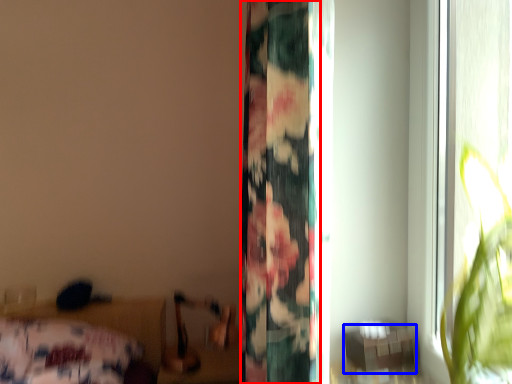
Question: Which of the following is the farthest to the observer, curtain (highlighted by a red box) or table (highlighted by a blue box)?

Choices:
 (A) curtain
 (B) table

Answer: (B)